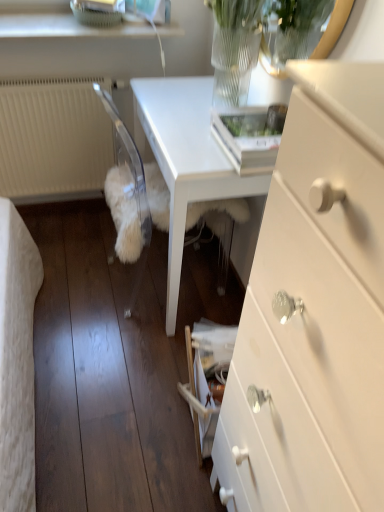
Question: From the image's perspective, would you say white textured radiator at left is positioned over white glossy chest of drawers at center right?

Choices:
 (A) yes
 (B) no

Answer: (A)

Question: Does white textured radiator at left have a larger size compared to white glossy chest of drawers at center right?

Choices:
 (A) no
 (B) yes

Answer: (A)

Question: From the image's perspective, is white textured radiator at left located beneath white glossy chest of drawers at center right?

Choices:
 (A) no
 (B) yes

Answer: (A)

Question: Can you confirm if white textured radiator at left is shorter than white glossy chest of drawers at center right?

Choices:
 (A) no
 (B) yes

Answer: (B)

Question: Is white textured radiator at left oriented away from white glossy chest of drawers at center right?

Choices:
 (A) no
 (B) yes

Answer: (A)

Question: Does white textured radiator at left have a lesser width compared to white glossy chest of drawers at center right?

Choices:
 (A) yes
 (B) no

Answer: (A)

Question: Does white textured radiator at left come behind white glossy table at center?

Choices:
 (A) yes
 (B) no

Answer: (A)

Question: Is white textured radiator at left closer to the viewer compared to white glossy table at center?

Choices:
 (A) yes
 (B) no

Answer: (B)

Question: From the image's perspective, is white textured radiator at left beneath white glossy table at center?

Choices:
 (A) no
 (B) yes

Answer: (A)

Question: Considering the relative sizes of white textured radiator at left and white glossy table at center in the image provided, is white textured radiator at left thinner than white glossy table at center?

Choices:
 (A) no
 (B) yes

Answer: (B)

Question: Would you say white glossy table at center is part of white textured radiator at left's contents?

Choices:
 (A) yes
 (B) no

Answer: (B)

Question: Considering the relative sizes of white textured radiator at left and white glossy table at center in the image provided, is white textured radiator at left wider than white glossy table at center?

Choices:
 (A) no
 (B) yes

Answer: (A)

Question: Does white glossy table at center appear on the right side of white glossy chest of drawers at center right?

Choices:
 (A) yes
 (B) no

Answer: (B)